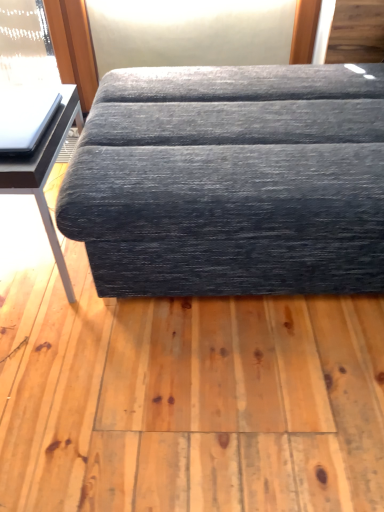
Question: Can we say textured gray fabric couch at center lies outside matte black table at left?

Choices:
 (A) no
 (B) yes

Answer: (B)

Question: Does textured gray fabric couch at center have a greater width compared to matte black table at left?

Choices:
 (A) no
 (B) yes

Answer: (B)

Question: From a real-world perspective, is textured gray fabric couch at center on matte black table at left?

Choices:
 (A) no
 (B) yes

Answer: (B)

Question: Does textured gray fabric couch at center appear on the right side of matte black table at left?

Choices:
 (A) yes
 (B) no

Answer: (A)

Question: Is textured gray fabric couch at center next to matte black table at left and touching it?

Choices:
 (A) yes
 (B) no

Answer: (B)

Question: Is textured gray fabric couch at center not close to matte black table at left?

Choices:
 (A) yes
 (B) no

Answer: (B)

Question: Can you confirm if matte black table at left is taller than textured gray fabric couch at center?

Choices:
 (A) no
 (B) yes

Answer: (A)

Question: Can you confirm if matte black table at left is thinner than textured gray fabric couch at center?

Choices:
 (A) no
 (B) yes

Answer: (B)

Question: From a real-world perspective, is matte black table at left physically above textured gray fabric couch at center?

Choices:
 (A) yes
 (B) no

Answer: (B)

Question: Is textured gray fabric couch at center at the back of matte black table at left?

Choices:
 (A) no
 (B) yes

Answer: (A)

Question: Could you tell me if matte black table at left is facing textured gray fabric couch at center?

Choices:
 (A) no
 (B) yes

Answer: (A)

Question: Considering the relative sizes of matte black table at left and textured gray fabric couch at center in the image provided, is matte black table at left smaller than textured gray fabric couch at center?

Choices:
 (A) yes
 (B) no

Answer: (A)

Question: From a real-world perspective, is matte black table at left physically located above or below textured gray fabric couch at center?

Choices:
 (A) above
 (B) below

Answer: (B)